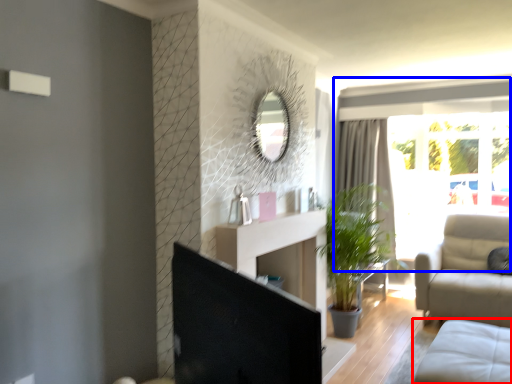
Question: Which of the following is the closest to the observer, studio couch (highlighted by a red box) or window (highlighted by a blue box)?

Choices:
 (A) studio couch
 (B) window

Answer: (A)